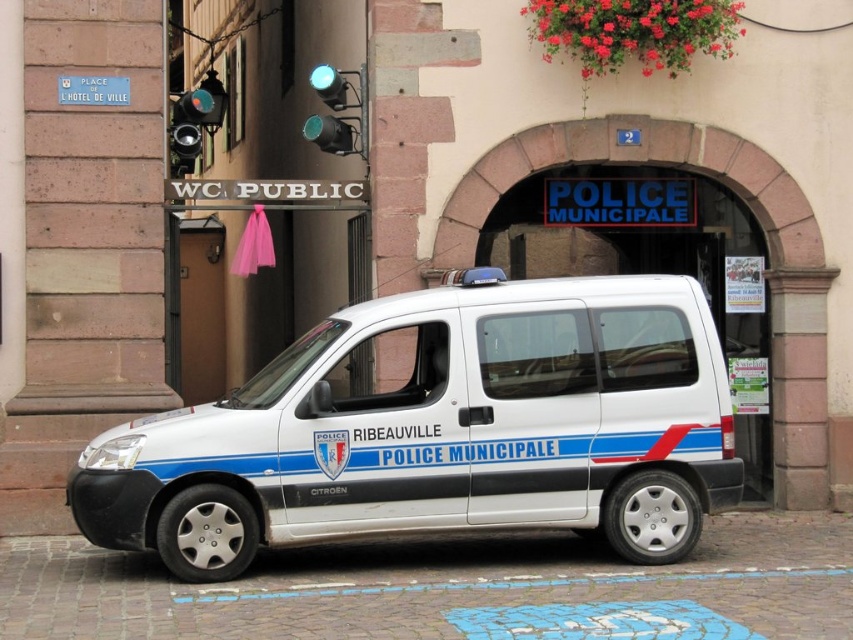
Can you confirm if white metallic van at center is positioned above metallic green traffic light at upper center?

No.

Where is `white metallic van at center`? white metallic van at center is located at coordinates (440, 428).